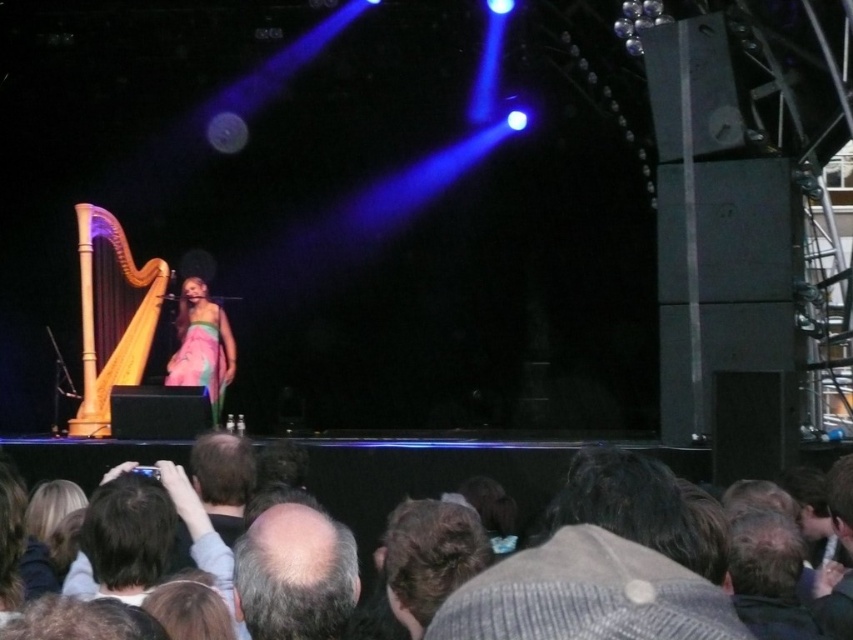
Is bald head at center thinner than pastel silk dress at center?

Yes.

Is bald head at center further to the viewer compared to pastel silk dress at center?

No, it is not.

Locate an element on the screen. The image size is (853, 640). bald head at center is located at coordinates (294, 573).

Is point (552, 480) farther from viewer compared to point (86, 285)?

That is False.

Image resolution: width=853 pixels, height=640 pixels. Find the location of `dark brown hair at lower center`. dark brown hair at lower center is located at coordinates (427, 476).

Which is more to the left, bald head at center or natural wood harp at left?

From the viewer's perspective, natural wood harp at left appears more on the left side.

Does bald head at center have a lesser width compared to natural wood harp at left?

Yes.

Which is in front, point (260, 540) or point (80, 410)?

Point (260, 540) is more forward.

You are a GUI agent. You are given a task and a screenshot of the screen. Output one action in this format:
    pyautogui.click(x=<x>, y=<y>)
    Task: Click on the bald head at center
    
    Given the screenshot: What is the action you would take?
    pyautogui.click(x=294, y=573)